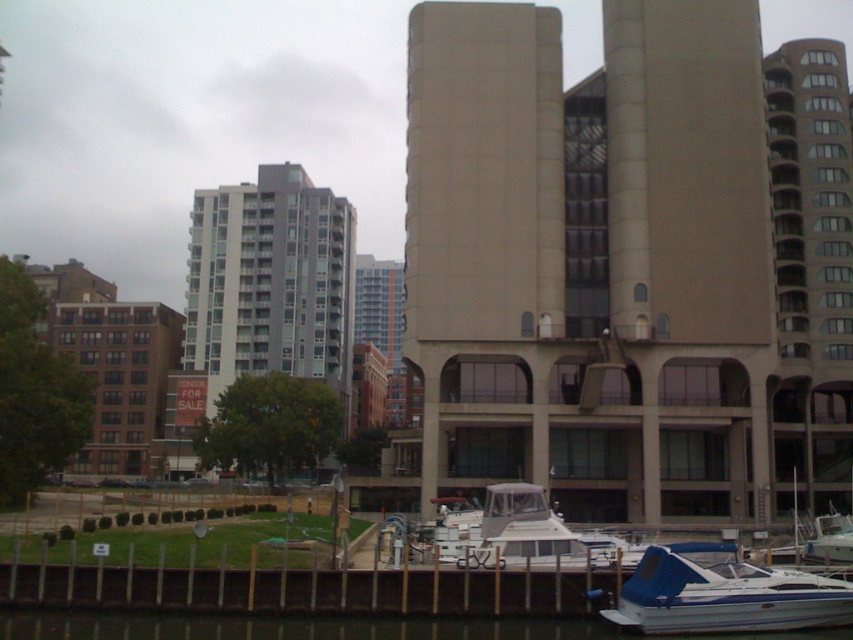
In the scene shown: You are standing at the origin point of the coordinate system in the image. You need to navigate to the blue vinyl boat at lower right. What are the coordinates you need to move to?

The coordinates for the blue vinyl boat at lower right are at point (x=723, y=593).